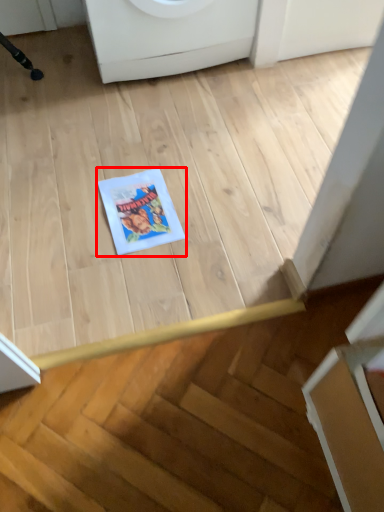
Question: From the image's perspective, where is comic book (annotated by the red box) located in relation to washing machine in the image?

Choices:
 (A) above
 (B) below

Answer: (B)